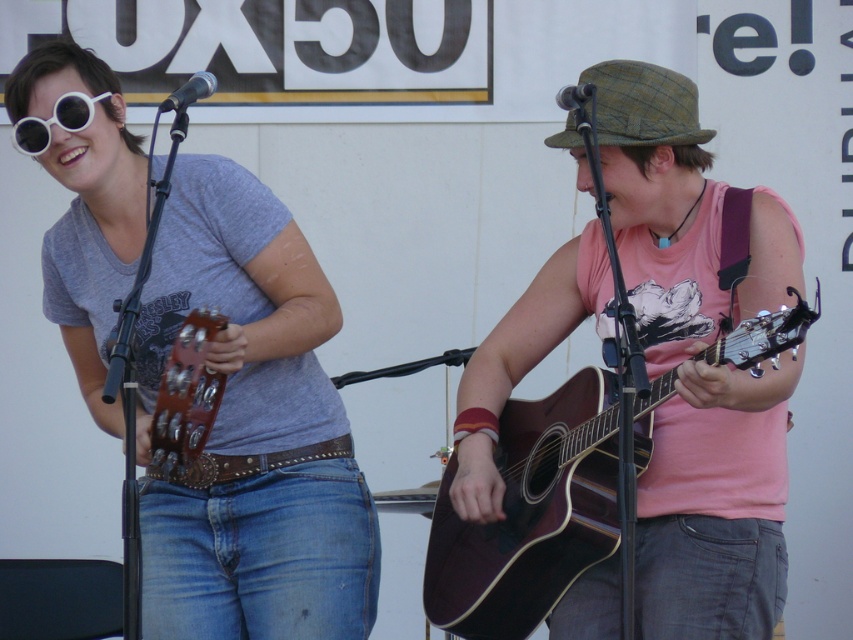
Question: Is matte gray t-shirt at center wider than white matte sunglasses at upper left?

Choices:
 (A) yes
 (B) no

Answer: (A)

Question: Can you confirm if dark brown acoustic guitar at center is positioned to the right of metallic gray microphone at upper center?

Choices:
 (A) yes
 (B) no

Answer: (A)

Question: Can you confirm if white matte sunglasses at upper left is positioned to the left of metallic silver microphone at upper left?

Choices:
 (A) yes
 (B) no

Answer: (A)

Question: Which of the following is the farthest from the observer?

Choices:
 (A) pyautogui.click(x=189, y=317)
 (B) pyautogui.click(x=227, y=408)

Answer: (B)

Question: Which point is closer to the camera?

Choices:
 (A) (625, 88)
 (B) (618, 531)

Answer: (B)

Question: Which point is farther to the camera?

Choices:
 (A) matte gray t-shirt at center
 (B) metallic silver microphone at upper left
 (C) wooden acoustic guitar at left

Answer: (B)